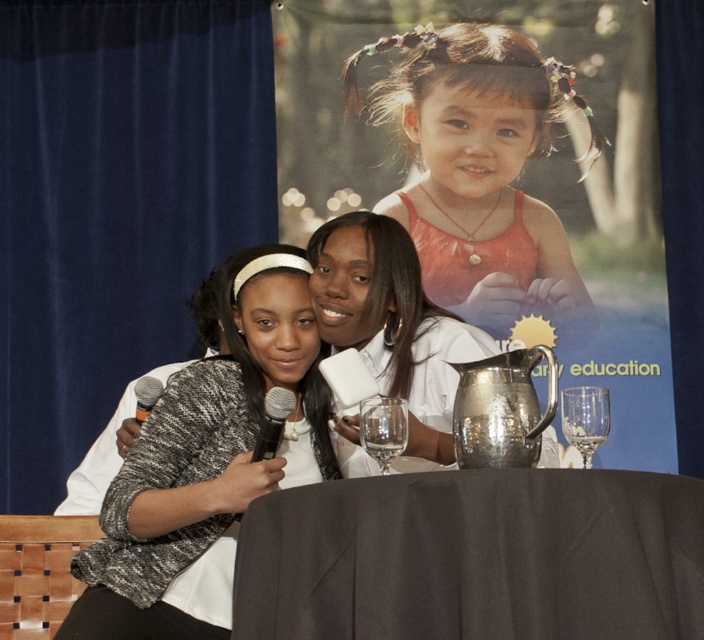
Question: Estimate the real-world distances between objects in this image. Which object is closer to the silver metallic microphone at center?

Choices:
 (A) gray knit sweater at center
 (B) matte orange dress at center
 (C) transparent glass at lower right
 (D) black metallic microphone at center

Answer: (A)

Question: Which object is farther from the camera taking this photo?

Choices:
 (A) matte orange dress at center
 (B) gray knit sweater at center
 (C) transparent glass wine glass at center
 (D) black metallic microphone at center

Answer: (A)

Question: Does black fabric table at center have a larger size compared to black metallic microphone at center?

Choices:
 (A) yes
 (B) no

Answer: (A)

Question: Is gray knit sweater at center smaller than transparent glass wine glass at center?

Choices:
 (A) no
 (B) yes

Answer: (A)

Question: Which of the following is the farthest from the observer?

Choices:
 (A) (389, 438)
 (B) (472, 28)
 (C) (681, 531)

Answer: (B)

Question: Does black fabric table at center have a larger size compared to black metallic microphone at center?

Choices:
 (A) yes
 (B) no

Answer: (A)